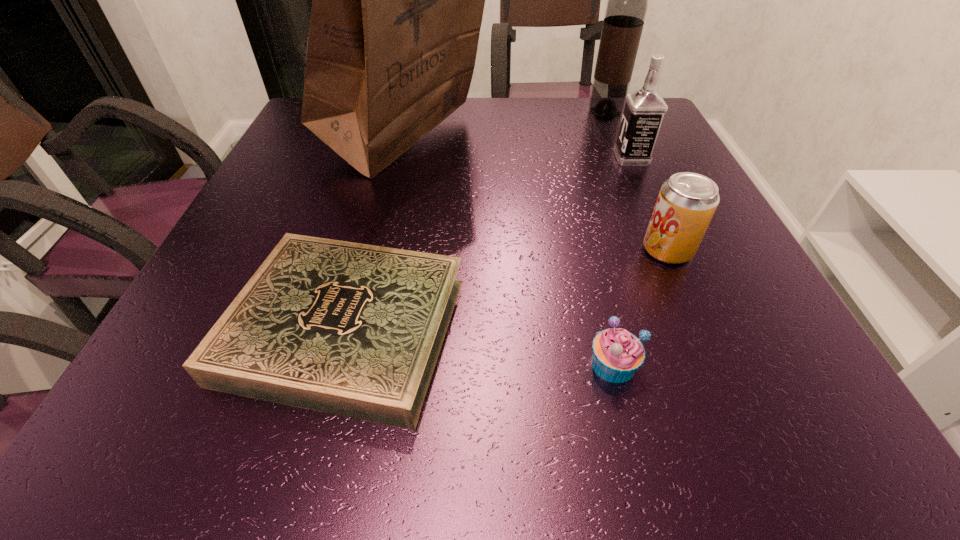
I want to click on free space at the far right corner, so click(663, 133).

Locate an element on the screen. vacant space in between the fifth shortest object and the grocery bag is located at coordinates (506, 127).

I want to click on vacant point located between the muffin and the third tallest object, so click(622, 261).

Where is `free space between the fourth tallest object and the fourth object from right to left`? This screenshot has height=540, width=960. free space between the fourth tallest object and the fourth object from right to left is located at coordinates (640, 307).

Where is `free spot between the third tallest object and the tallest object`? free spot between the third tallest object and the tallest object is located at coordinates click(x=518, y=151).

The height and width of the screenshot is (540, 960). In order to click on vacant space that's between the third shortest object and the shortest object in this screenshot , I will do `click(507, 289)`.

This screenshot has width=960, height=540. Find the location of `free spot between the wine bottle and the tallest object`. free spot between the wine bottle and the tallest object is located at coordinates (506, 127).

Locate an element on the screen. Image resolution: width=960 pixels, height=540 pixels. vacant space that is in between the grocery bag and the fourth object from right to left is located at coordinates (510, 254).

The width and height of the screenshot is (960, 540). I want to click on empty space that is in between the fourth shortest object and the fourth tallest object, so click(x=650, y=204).

Find the location of a particular element. vacant space that is in between the fourth tallest object and the hardback book is located at coordinates (507, 289).